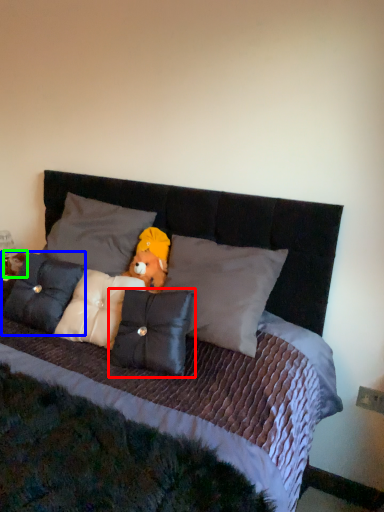
Question: Which object is positioned closest to pillow (highlighted by a red box)? Select from pillow (highlighted by a blue box) and figurine (highlighted by a green box).

Choices:
 (A) pillow
 (B) figurine

Answer: (A)